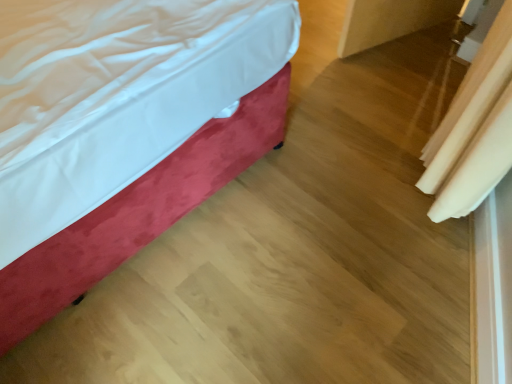
You are a GUI agent. You are given a task and a screenshot of the screen. Output one action in this format:
    pyautogui.click(x=<x>, y=<y>)
    Task: Click on the velvet red bed at lower left
    The image size is (512, 384).
    Given the screenshot: What is the action you would take?
    pyautogui.click(x=124, y=131)

The image size is (512, 384). What do you see at coordinates (124, 131) in the screenshot?
I see `velvet red bed at lower left` at bounding box center [124, 131].

Find the location of a particular element. velvet red bed at lower left is located at coordinates (124, 131).